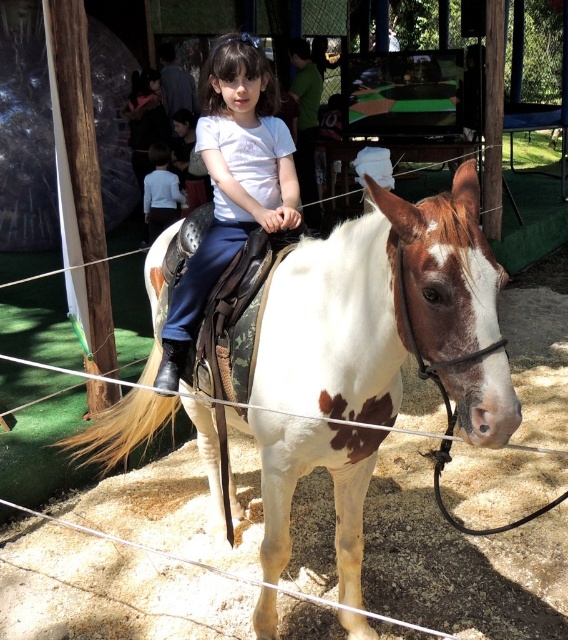
Question: Which point is farther from the camera taking this photo?

Choices:
 (A) (277, 326)
 (B) (148, 205)
 (C) (252, 72)

Answer: (B)

Question: Among these objects, which one is nearest to the camera?

Choices:
 (A) white speckled horse at center
 (B) white matte shirt at center

Answer: (A)

Question: Among these objects, which one is nearest to the camera?

Choices:
 (A) white matte shirt at center
 (B) white speckled horse at center
 (C) light blue shirt at center

Answer: (B)

Question: Does white matte shirt at center appear on the right side of light blue shirt at center?

Choices:
 (A) yes
 (B) no

Answer: (A)

Question: Where is white matte shirt at center located in relation to light blue shirt at center in the image?

Choices:
 (A) above
 (B) below

Answer: (B)

Question: Is white matte shirt at center further to the viewer compared to light blue shirt at center?

Choices:
 (A) yes
 (B) no

Answer: (B)